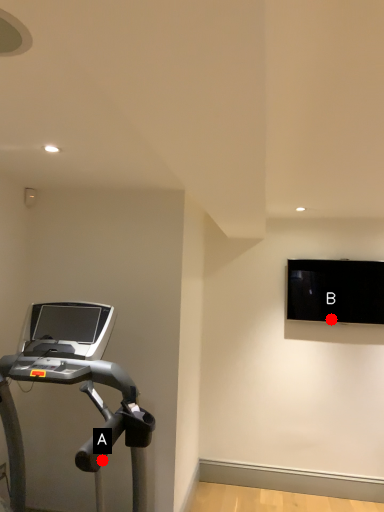
Question: Two points are circled on the image, labeled by A and B beside each circle. Which point is closer to the camera?

Choices:
 (A) A is closer
 (B) B is closer

Answer: (A)